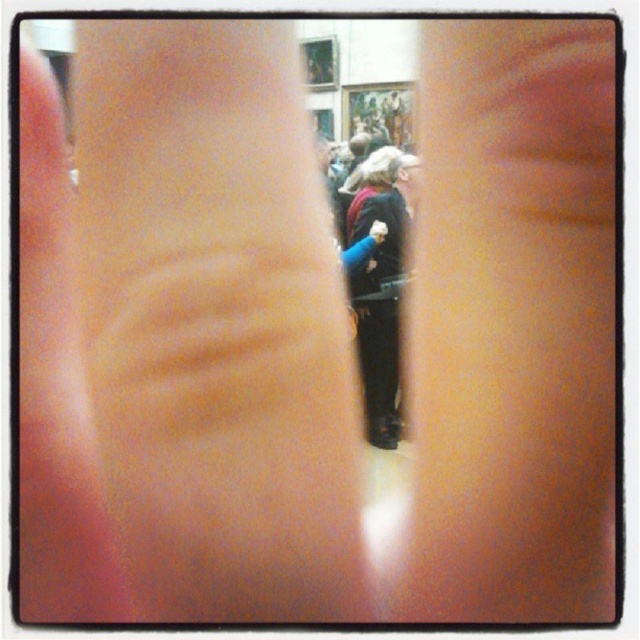
You are a photographer trying to capture a clear shot of the velvet black coat at center. However, there is a smooth skin hand at center blocking your view. Based on their positions, can you move the hand to the side to get an unobstructed view of the coat?

The smooth skin hand at center is closer to the viewer than the velvet black coat at center. To get an unobstructed view of the velvet black coat at center, you would need to move the smooth skin hand at center out of the way since it is blocking the coat.

You are an artist trying to sketch the scene through the finger. Which object, the pink smooth skin at center or the smooth skin hand at center, is closer to your eyes?

The pink smooth skin at center is closer to your eyes because it is located above the smooth skin hand at center, indicating it is in a more forward position in the scene.